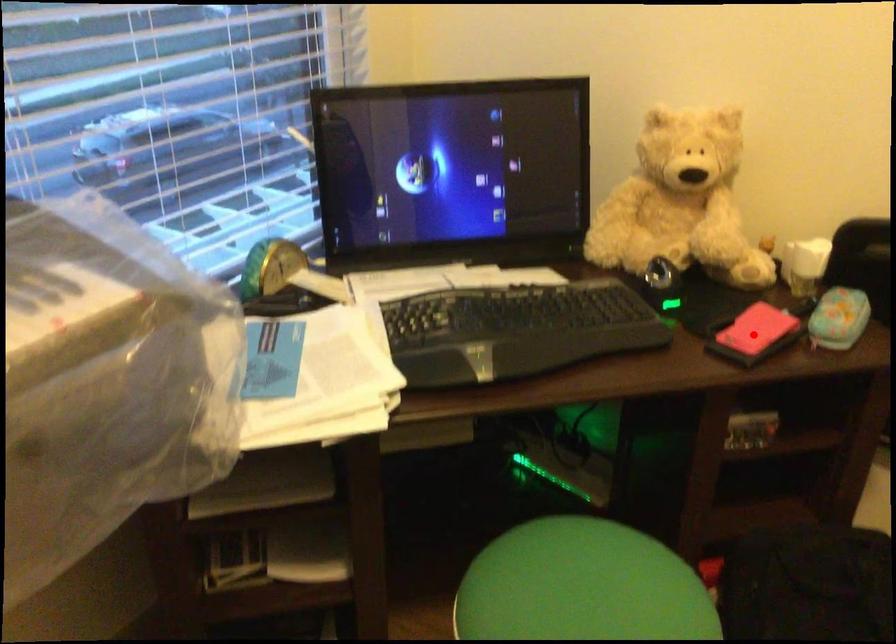
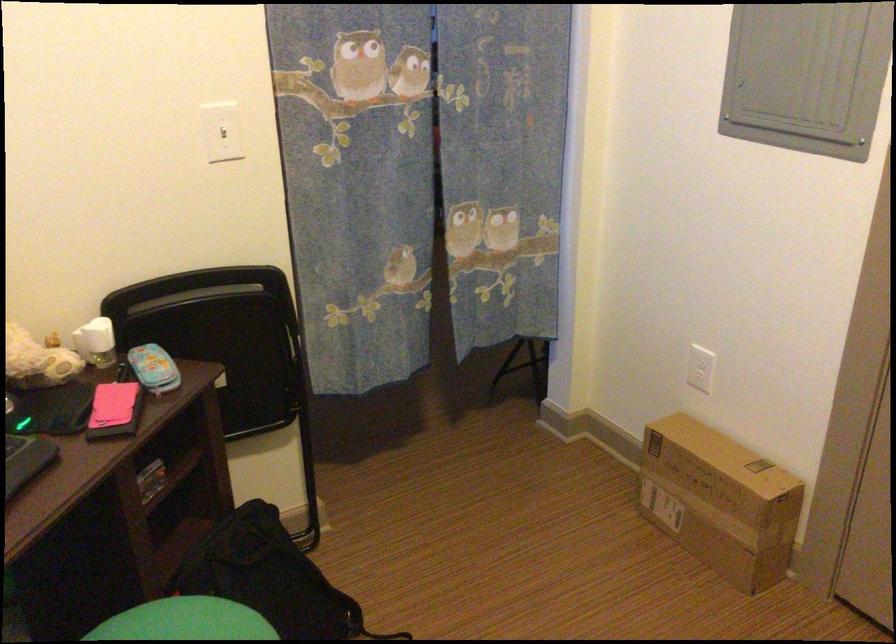
Question: I am providing you with two images of the same scene from different viewpoints. A red point is marked on the first image. Can you still see the location of the red point in image 2?

Choices:
 (A) Yes
 (B) No

Answer: (A)